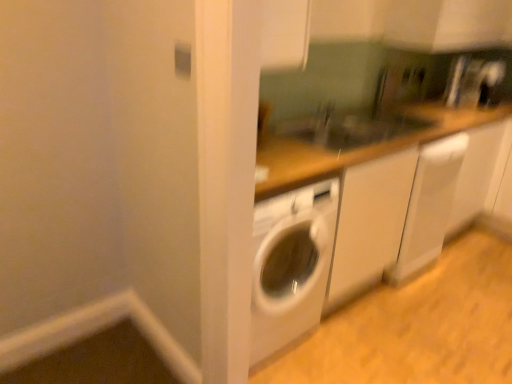
Question: Should I look upward or downward to see matte brown sink at center?

Choices:
 (A) down
 (B) up

Answer: (B)